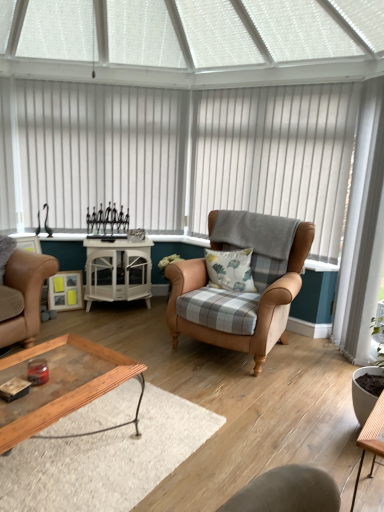
Question: Considering the relative positions of leather armchair at center and fluffy cotton pillow at center in the image provided, is leather armchair at center to the right of fluffy cotton pillow at center from the viewer's perspective?

Choices:
 (A) yes
 (B) no

Answer: (A)

Question: Does leather armchair at center turn towards fluffy cotton pillow at center?

Choices:
 (A) yes
 (B) no

Answer: (A)

Question: Is fluffy cotton pillow at center at the back of leather armchair at center?

Choices:
 (A) no
 (B) yes

Answer: (B)

Question: Can you confirm if leather armchair at center is thinner than fluffy cotton pillow at center?

Choices:
 (A) yes
 (B) no

Answer: (B)

Question: Can fluffy cotton pillow at center be found inside leather armchair at center?

Choices:
 (A) yes
 (B) no

Answer: (A)

Question: Is point (314, 218) closer or farther from the camera than point (119, 281)?

Choices:
 (A) closer
 (B) farther

Answer: (A)

Question: In the image, is white vertical blinds at center, positioned as the 2th blind in left-to-right order, on the left side or the right side of white glossy cabinet at center, marked as the first table in a left-to-right arrangement?

Choices:
 (A) left
 (B) right

Answer: (B)

Question: Is white vertical blinds at center, positioned as the 2th blind in left-to-right order, wider or thinner than white glossy cabinet at center, the 2th table in the bottom-to-top sequence?

Choices:
 (A) wide
 (B) thin

Answer: (B)

Question: From the image's perspective, relative to white glossy cabinet at center, the 1th table positioned from the back, is white vertical blinds at center, placed as the 1th blind when sorted from right to left, above or below?

Choices:
 (A) above
 (B) below

Answer: (A)

Question: Based on their positions, is fluffy cotton pillow at center located to the left or right of leather armchair at center?

Choices:
 (A) left
 (B) right

Answer: (A)

Question: Is fluffy cotton pillow at center in front of or behind leather armchair at center in the image?

Choices:
 (A) behind
 (B) front

Answer: (A)

Question: In terms of size, does fluffy cotton pillow at center appear bigger or smaller than leather armchair at center?

Choices:
 (A) big
 (B) small

Answer: (B)

Question: In terms of width, does fluffy cotton pillow at center look wider or thinner when compared to leather armchair at center?

Choices:
 (A) thin
 (B) wide

Answer: (A)

Question: Looking at the image, does wooden table at lower right, positioned as the 2th table in left-to-right order, seem bigger or smaller compared to white glossy cabinet at center, which is counted as the first table, starting from the top?

Choices:
 (A) small
 (B) big

Answer: (A)

Question: Is wooden table at lower right, the 1th table when ordered from right to left, inside or outside of white glossy cabinet at center, the 1th table positioned from the back?

Choices:
 (A) inside
 (B) outside

Answer: (B)